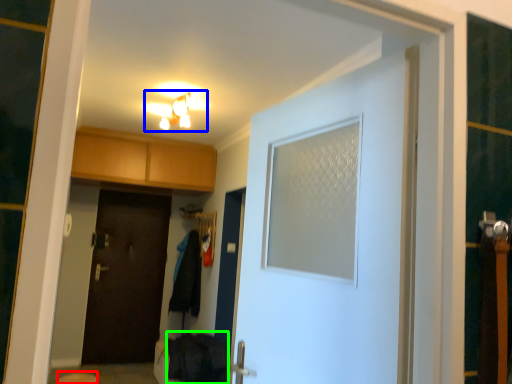
Question: Which object is positioned farthest from step stool (highlighted by a red box)? Select from light fixture (highlighted by a blue box) and laundry (highlighted by a green box).

Choices:
 (A) light fixture
 (B) laundry

Answer: (A)